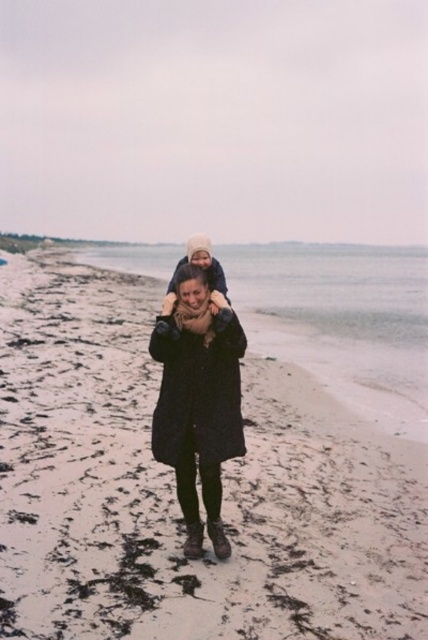
Question: Does white sandy beach at center appear under matte black coat at center?

Choices:
 (A) yes
 (B) no

Answer: (B)

Question: Among these objects, which one is farthest from the camera?

Choices:
 (A) white sandy beach at center
 (B) matte black coat at center

Answer: (B)

Question: Which is nearer to the matte black coat at center?

Choices:
 (A) white sandy beach at center
 (B) matte beige hat at upper center

Answer: (B)

Question: Does matte black coat at center have a larger size compared to matte beige hat at upper center?

Choices:
 (A) yes
 (B) no

Answer: (A)

Question: Among these objects, which one is farthest from the camera?

Choices:
 (A) matte beige hat at upper center
 (B) white sandy beach at center
 (C) matte black coat at center

Answer: (A)

Question: Is matte black coat at center bigger than matte beige hat at upper center?

Choices:
 (A) no
 (B) yes

Answer: (B)